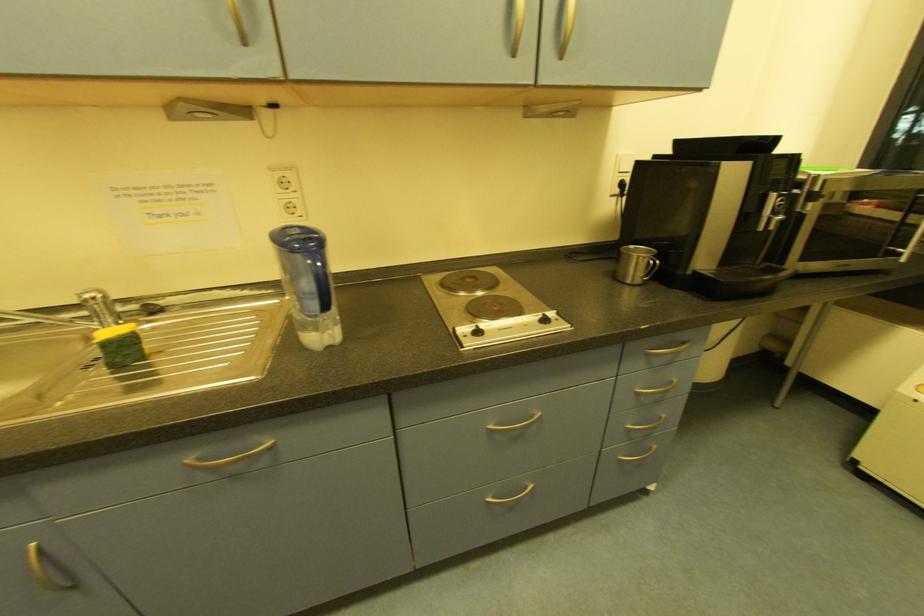
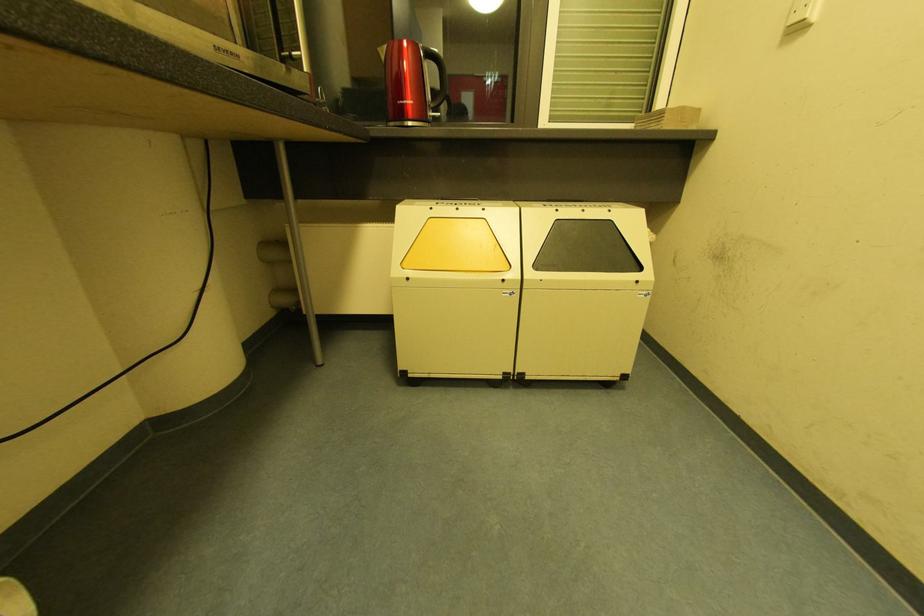
Question: The images are taken continuously from a first-person perspective. In which direction is your viewpoint rotating?

Choices:
 (A) Left
 (B) Right
 (C) Up
 (D) Down

Answer: (B)